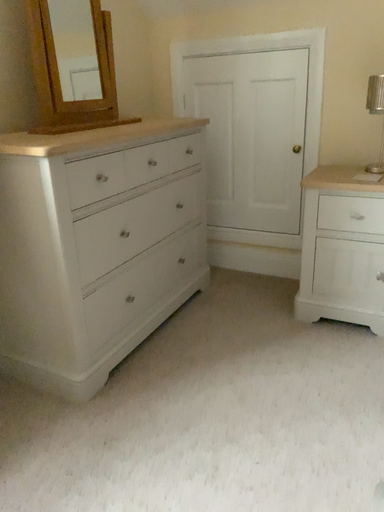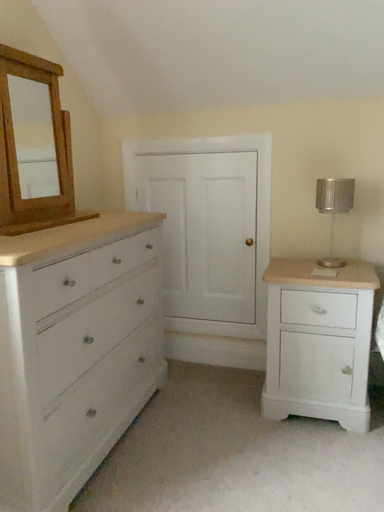
Question: Which way did the camera rotate in the video?

Choices:
 (A) rotated left
 (B) rotated right

Answer: (B)